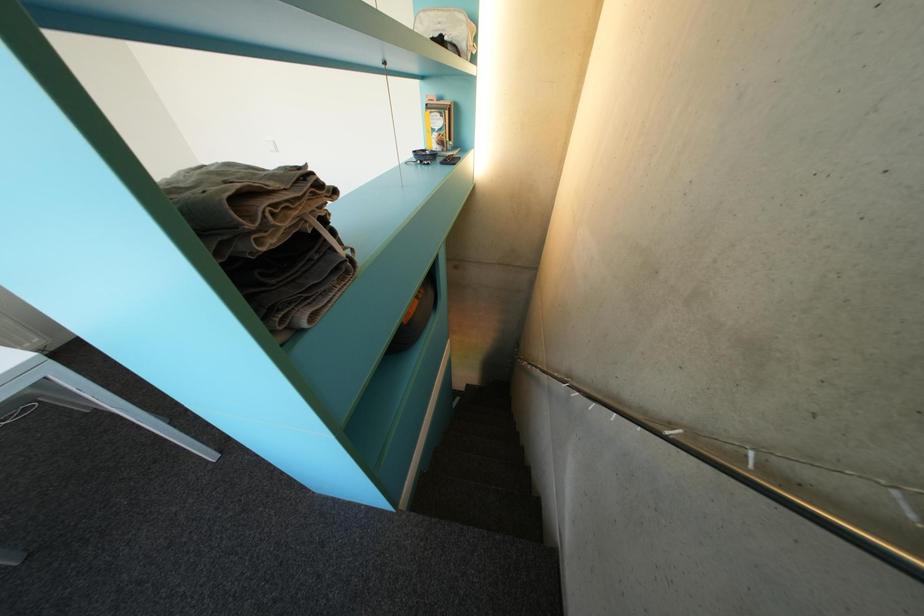
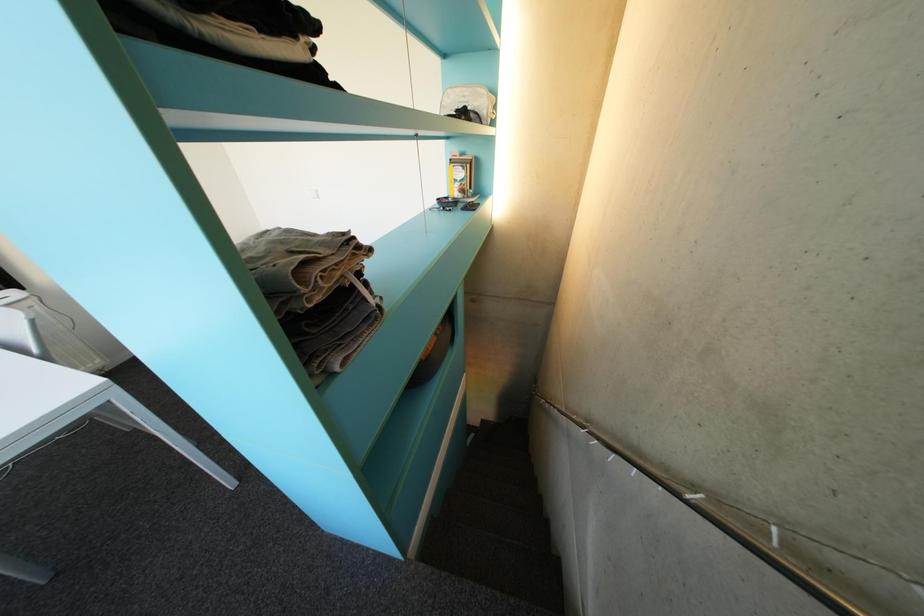
Question: In a continuous first-person perspective shot, in which direction is the camera moving?

Choices:
 (A) Left
 (B) Right
 (C) Forward
 (D) Backward

Answer: (D)